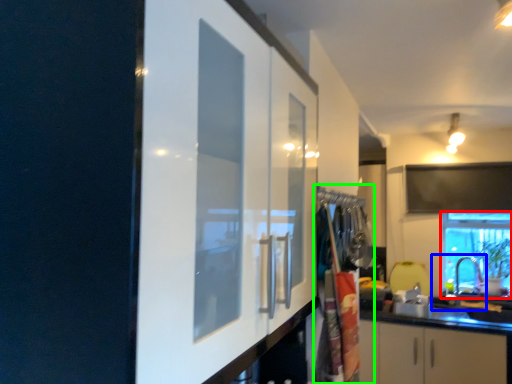
Question: Estimate the real-world distances between objects in this image. Which object is closer to window (highlighted by a red box), sink (highlighted by a blue box) or laundry (highlighted by a green box)?

Choices:
 (A) sink
 (B) laundry

Answer: (A)